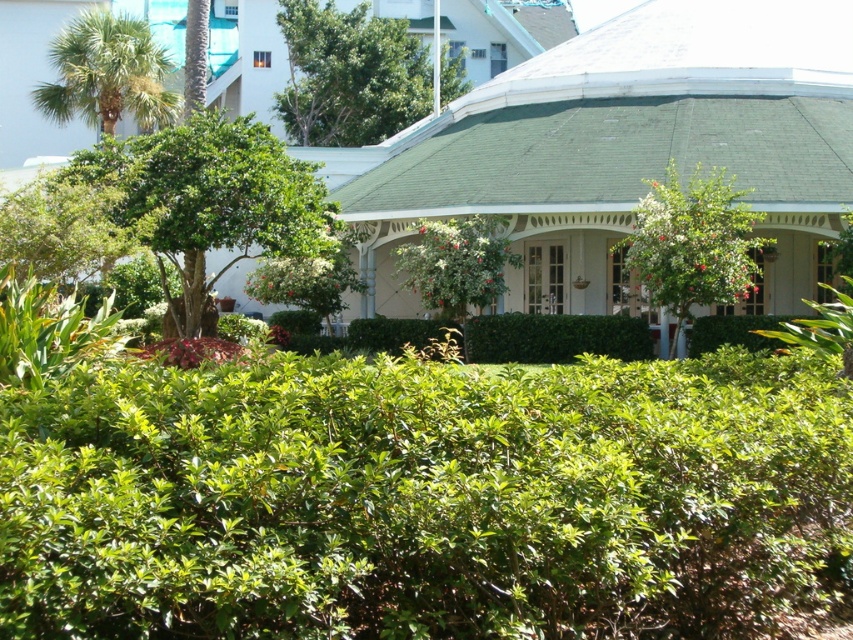
You are standing at the entrance of the house and want to take a photo of the green leafy tree at upper center. Based on its 2D coordinates, where should you position yourself to ensure the tree is centered in your camera view?

The green leafy tree at upper center is located at coordinates 0.117 on the x axis and 0.410 on the y axis, so to center it in your camera view, you should position yourself directly in front of the house entrance and slightly to the left and lower side to align with those coordinates.

You are standing at the front porch of the house and want to walk to the green leafy tree at upper center. There is a green leafy tree at center blocking your path. Can you walk around it to reach your destination?

The green leafy tree at upper center is 24.62 meters away from the green leafy tree at center. Since the distance between them is significant, you can walk around the green leafy tree at center to reach the green leafy tree at upper center.